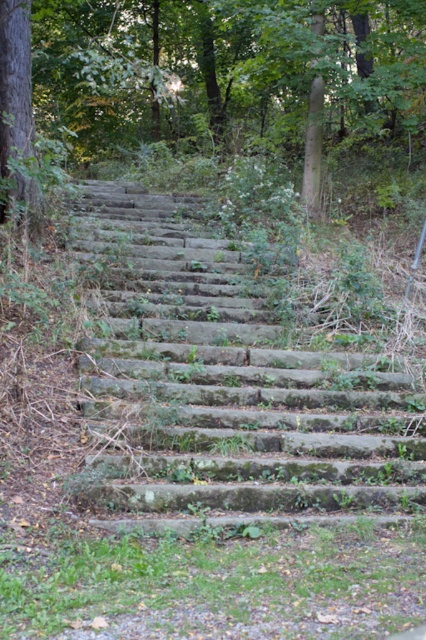
Question: Where is green mossy stone stairs at center located in relation to green mossy stone steps at center in the image?

Choices:
 (A) right
 (B) left

Answer: (A)

Question: Is green mossy stone stairs at center positioned behind green mossy stone steps at center?

Choices:
 (A) no
 (B) yes

Answer: (A)

Question: Where is green mossy stone stairs at center located in relation to green mossy stone steps at center in the image?

Choices:
 (A) right
 (B) left

Answer: (A)

Question: Which point is closer to the camera?

Choices:
 (A) green mossy stone steps at center
 (B) green mossy stone stairs at center

Answer: (B)

Question: Which of the following is the closest to the observer?

Choices:
 (A) green mossy stone stairs at center
 (B) green mossy stone steps at center

Answer: (A)